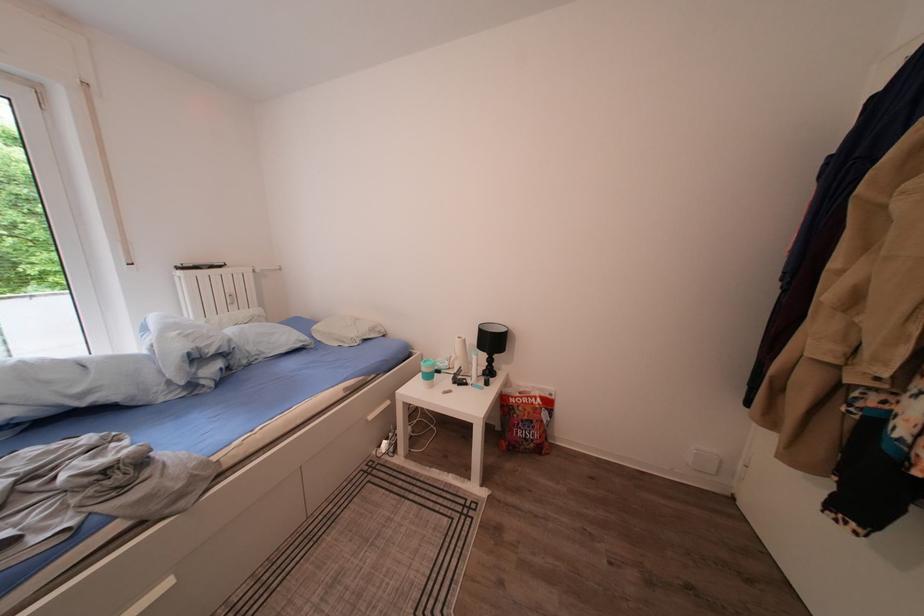
At what (x,y) coordinates should I click in order to perform the action: click on white drawer handle. Please return your answer as a coordinate pair (x, y). The width and height of the screenshot is (924, 616). Looking at the image, I should click on (378, 410).